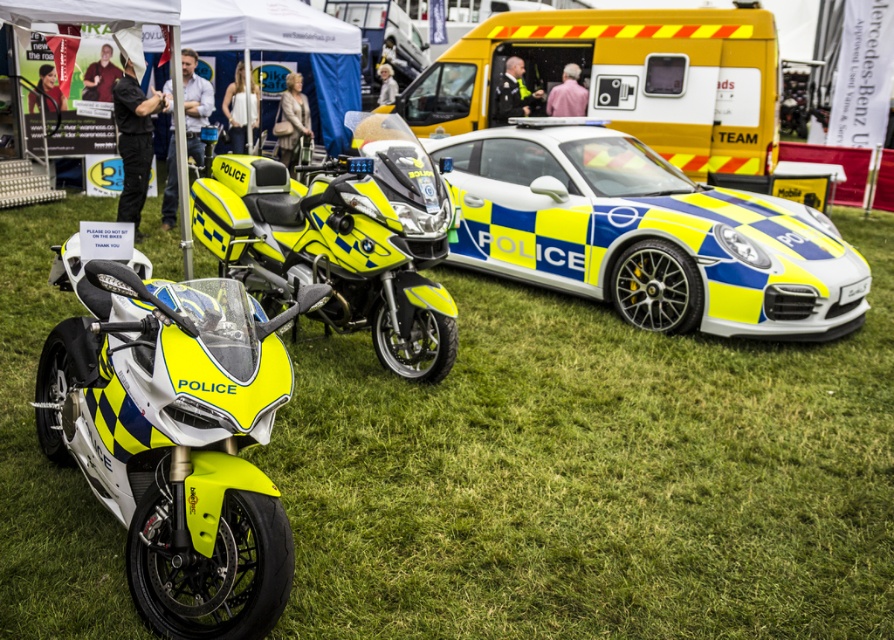
Question: Which object is positioned farthest from the yellow/blue checkered police car at center?

Choices:
 (A) yellow matte police motorcycle at left
 (B) yellowmattemotorcycle at center
 (C) green grass at center

Answer: (A)

Question: Is green grass at center to the right of yellow matte police motorcycle at left from the viewer's perspective?

Choices:
 (A) no
 (B) yes

Answer: (B)

Question: Among these objects, which one is nearest to the camera?

Choices:
 (A) yellow matte van at center
 (B) yellow matte police motorcycle at left
 (C) yellowmattemotorcycle at center
 (D) green grass at center

Answer: (B)

Question: Does yellow matte police motorcycle at left have a greater width compared to yellow matte van at center?

Choices:
 (A) no
 (B) yes

Answer: (A)

Question: Estimate the real-world distances between objects in this image. Which object is farther from the yellow matte van at center?

Choices:
 (A) green grass at center
 (B) yellow/blue checkered police car at center
 (C) yellowmattemotorcycle at center

Answer: (A)

Question: Is green grass at center below yellowmattemotorcycle at center?

Choices:
 (A) yes
 (B) no

Answer: (A)